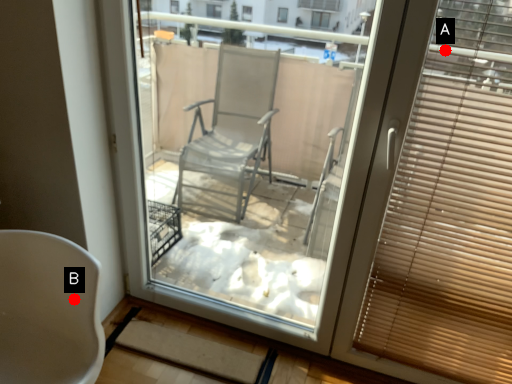
Question: Two points are circled on the image, labeled by A and B beside each circle. Which point is farther to the camera?

Choices:
 (A) A is further
 (B) B is further

Answer: (B)